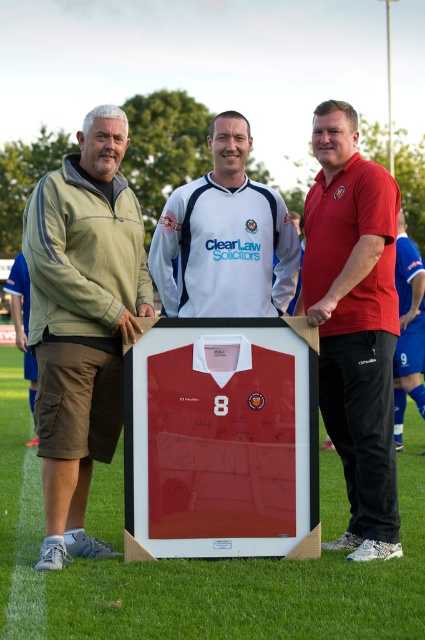
You are a photographer at the event and need to ensure all participants are visible in the photo. Given that the green fabric pants at left and the matte red polo shirt at center are in the frame, which one is more likely to be in the foreground based on their sizes?

The green fabric pants at left has a larger size compared to matte red polo shirt at center, so it is more likely to be in the foreground.

You are a photographer standing at the edge of the field. You need to take a photo that includes both the green fabric pants at left and the blue jersey at center. Given that your camera has a maximum focus range of 4 meters, will you be able to capture both subjects in focus?

The green fabric pants at left is 4.02 meters away from the blue jersey at center. Since the distance between them is slightly over 4 meters, the camera might struggle to keep both in focus simultaneously. However, if the camera can focus on one subject and the other is within the depth of field, it might still work. Alternatively, adjusting the aperture for a smaller opening could increase the depth of field enough to capture both.